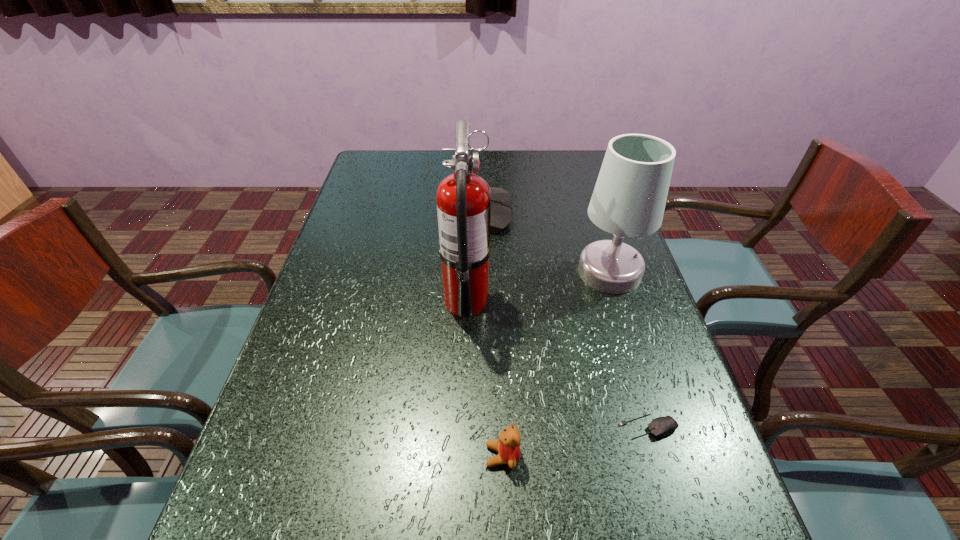
Locate an element on the screen. The width and height of the screenshot is (960, 540). free space at the far left corner of the desktop is located at coordinates (377, 155).

The width and height of the screenshot is (960, 540). What are the coordinates of `blank space at the far right corner of the desktop` in the screenshot? It's located at (553, 166).

This screenshot has height=540, width=960. I want to click on empty space that is in between the shortest object and the tallest object, so click(557, 363).

Find the location of a particular element. free spot between the teddy bear and the tallest object is located at coordinates (485, 378).

At what (x,y) coordinates should I click in order to perform the action: click on unoccupied area between the tallest object and the mouse. Please return your answer as a coordinate pair (x, y). Image resolution: width=960 pixels, height=540 pixels. Looking at the image, I should click on (557, 363).

This screenshot has height=540, width=960. I want to click on free space between the router and the fourth shortest object, so click(x=548, y=242).

The width and height of the screenshot is (960, 540). In order to click on vacant space that's between the tallest object and the fourth shortest object in this screenshot , I will do `click(538, 286)`.

In order to click on vacant space in between the fire extinguisher and the teddy bear in this screenshot , I will do `click(485, 378)`.

You are a GUI agent. You are given a task and a screenshot of the screen. Output one action in this format:
    pyautogui.click(x=<x>, y=<y>)
    Task: Click on the vacant space that's between the third tallest object and the teddy bear
    The height and width of the screenshot is (540, 960).
    Given the screenshot: What is the action you would take?
    pyautogui.click(x=495, y=334)

Locate an element on the screen. This screenshot has height=540, width=960. free space between the fire extinguisher and the fourth tallest object is located at coordinates (485, 378).